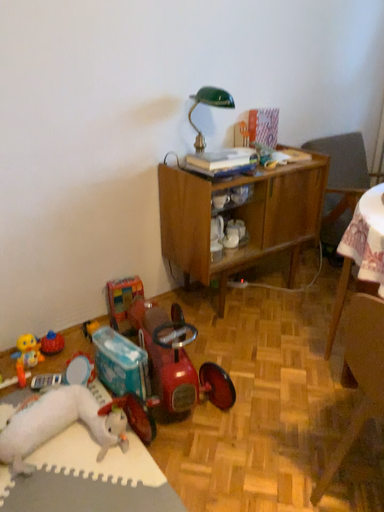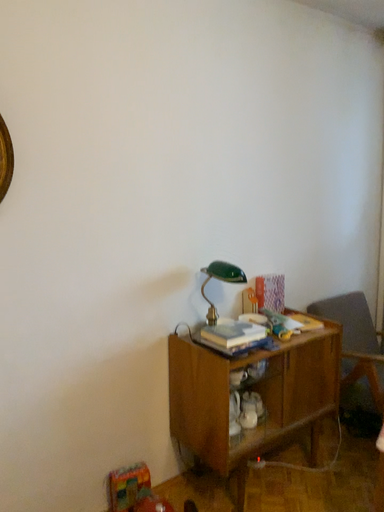
Question: How did the camera likely rotate when shooting the video?

Choices:
 (A) rotated downward
 (B) rotated upward

Answer: (B)